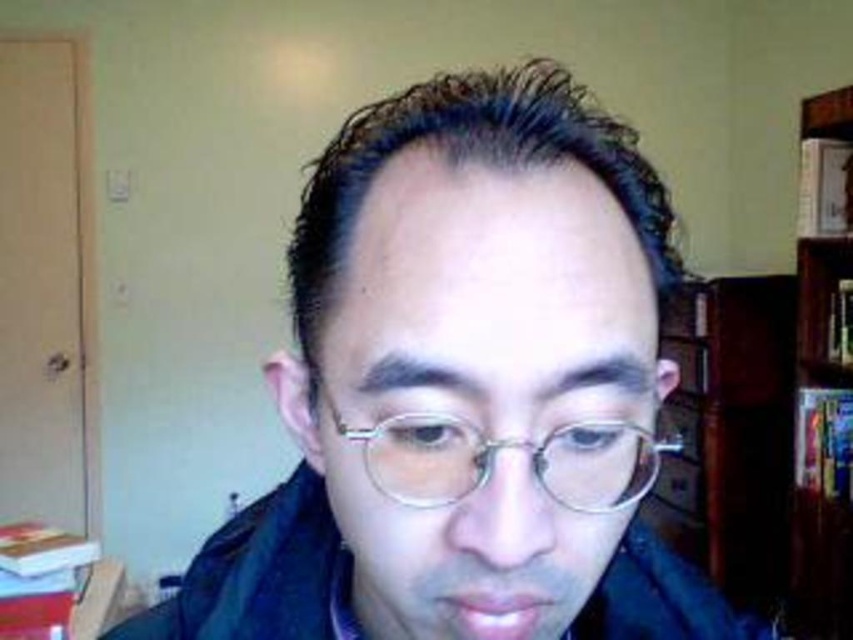
You are a photographer trying to capture a portrait of the person wearing the matte black glasses at center. You want to ensure the glasses are the main focus while still including the wooden bookcase at right in the background. Given their sizes, will the glasses appear larger than the bookcase in the photo?

The matte black glasses at center has a larger size compared to wooden bookcase at right, so yes, the glasses will appear larger than the bookcase in the photo.

You are standing in a room with a person in front of you. There are two points marked on the wall. The first point is at coordinates point (433,435) and the second is at point (815,550). If you were to walk straight towards the first point, would you pass by the second point before reaching the first one?

Point (433,435) is in front of point (815,550), so if you walk straight towards the first point, you would reach it before passing the second point.

You are a photographer adjusting your camera settings to focus on the matte black glasses at center. According to the coordinates provided, where exactly should you position your focus point?

You should position your focus point at coordinates point [465,387] to focus on the matte black glasses at center.